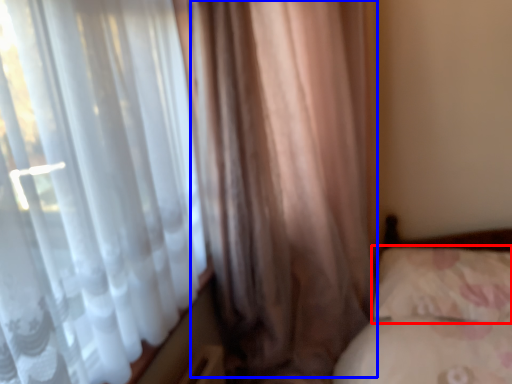
Question: Which object appears farthest to the camera in this image, pillow (highlighted by a red box) or curtain (highlighted by a blue box)?

Choices:
 (A) pillow
 (B) curtain

Answer: (A)